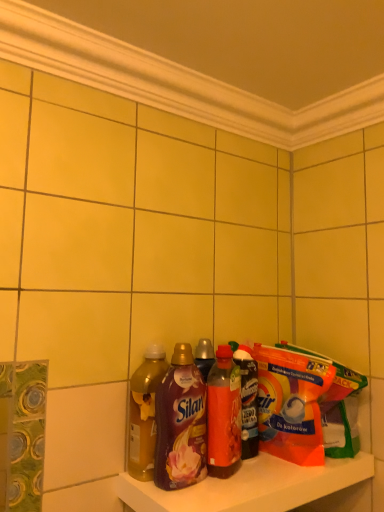
The height and width of the screenshot is (512, 384). Identify the location of empty space that is to the right of translucent plastic bottle at center, the second bottle viewed from the right. (269, 472).